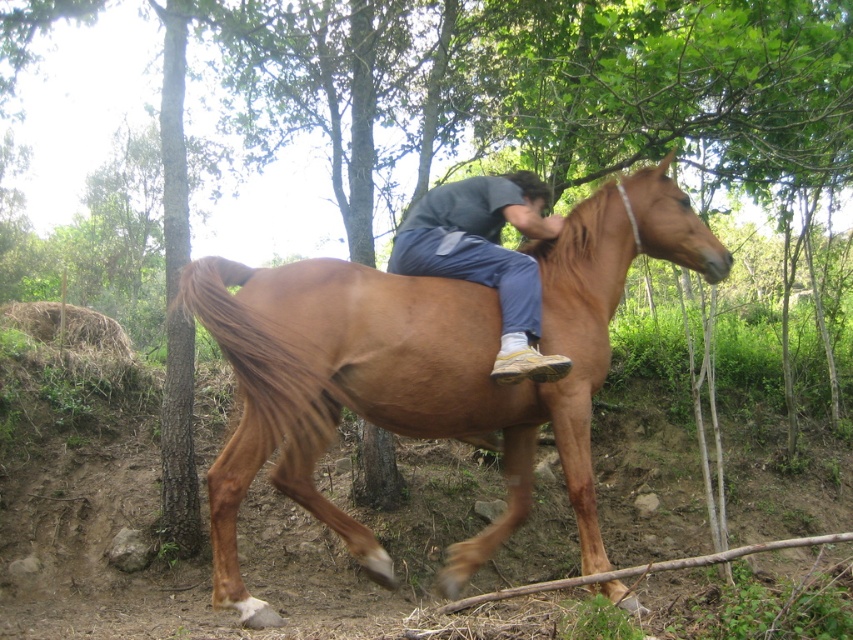
You are a photographer trying to capture the rider and horse in the image. You want to position your camera so that the brown glossy horse at center is on the right side of the matte blue jeans at center in the photo. Is this possible given their current positions?

Yes, because the brown glossy horse at center is already positioned to the right of the matte blue jeans at center, so the camera can be set to frame them that way.